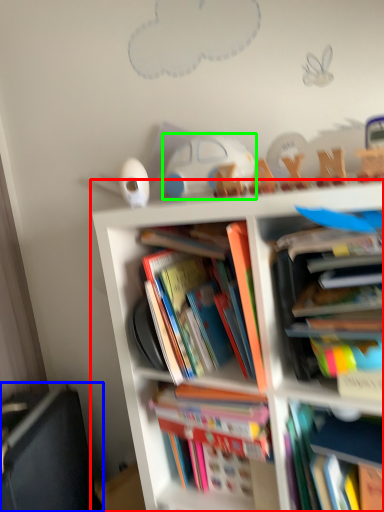
Question: Which object is positioned closest to bookcase (highlighted by a red box)? Select from shelf (highlighted by a blue box) and toy (highlighted by a green box).

Choices:
 (A) shelf
 (B) toy

Answer: (B)